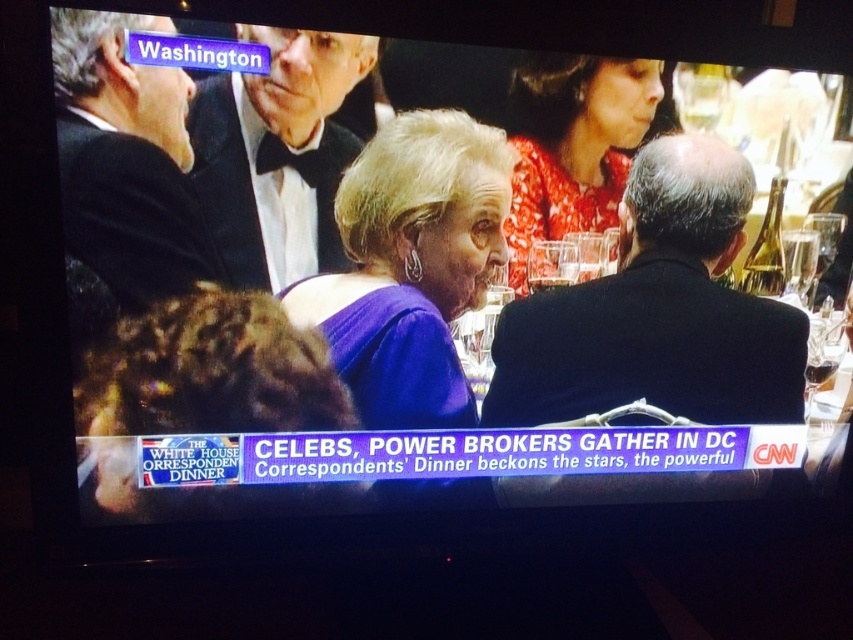
Does black suit at center come behind black tuxedo at upper center?

Yes, black suit at center is behind black tuxedo at upper center.

Between black suit at center and black tuxedo at upper center, which one is positioned lower?

black suit at center

Where is `black suit at center`? The height and width of the screenshot is (640, 853). black suit at center is located at coordinates (657, 310).

Identify the location of black suit at center. This screenshot has width=853, height=640. (657, 310).

Is black suit at center taller than floral dress at upper center?

Yes, black suit at center is taller than floral dress at upper center.

Is black suit at center thinner than floral dress at upper center?

No, black suit at center is not thinner than floral dress at upper center.

Is point (683, 209) farther from viewer compared to point (537, 54)?

Yes, point (683, 209) is farther from viewer.

In order to click on black suit at center in this screenshot , I will do `click(657, 310)`.

Is black tuxedo at left further to the viewer compared to floral dress at upper center?

No, it is not.

Between point (103, 81) and point (546, 58), which one is positioned behind?

Positioned behind is point (546, 58).

You are a GUI agent. You are given a task and a screenshot of the screen. Output one action in this format:
    pyautogui.click(x=<x>, y=<y>)
    Task: Click on the black tuxedo at left
    The width and height of the screenshot is (853, 640).
    Given the screenshot: What is the action you would take?
    pyautogui.click(x=126, y=161)